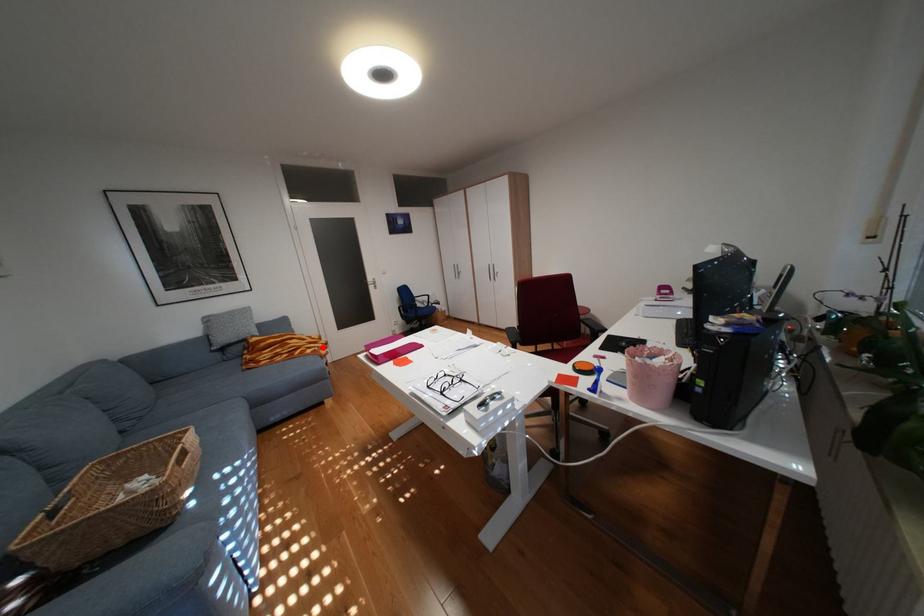
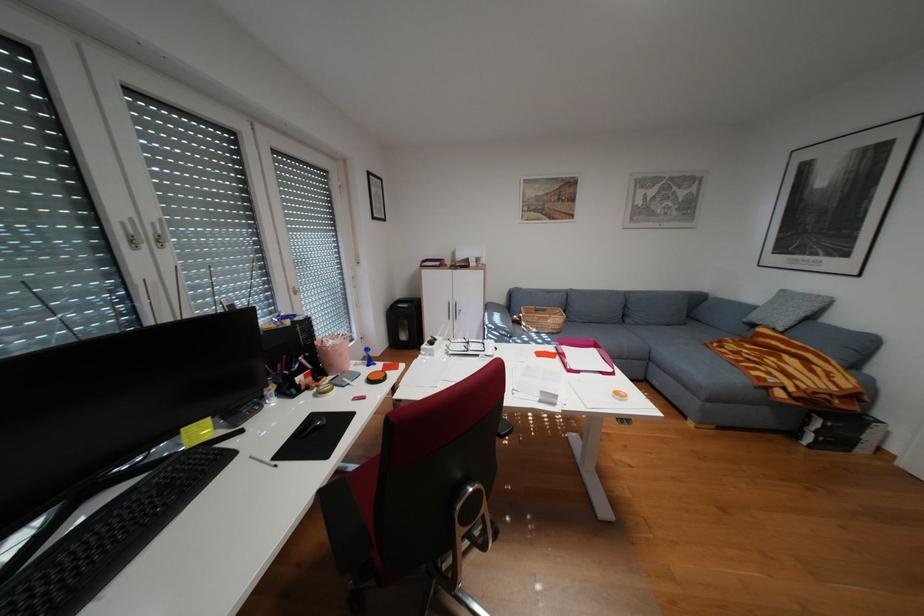
Question: I am providing you with two images of the same scene from different viewpoints. A red point is marked on the first image. Is the red point's position out of view in image 2?

Choices:
 (A) Yes
 (B) No

Answer: (B)